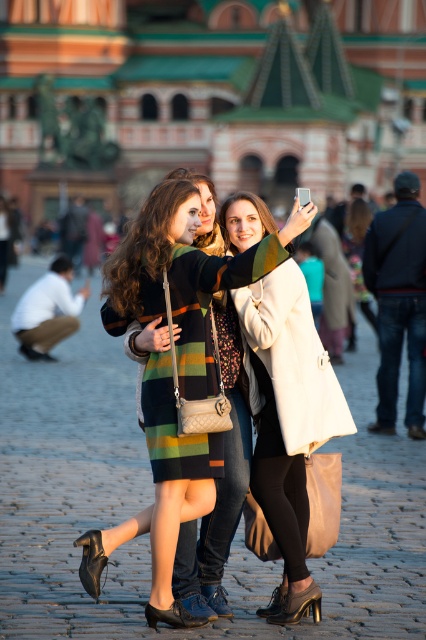
Question: Can you confirm if striped wool dress at center is thinner than white leather coat at center?

Choices:
 (A) yes
 (B) no

Answer: (B)

Question: Which point is closer to the camera?

Choices:
 (A) white leather coat at center
 (B) striped wool dress at center

Answer: (B)

Question: Which object is positioned closest to the striped wool dress at center?

Choices:
 (A) white leather coat at center
 (B) dark blue jeans at right

Answer: (A)

Question: Which object is farther from the camera taking this photo?

Choices:
 (A) dark blue jeans at right
 (B) striped wool dress at center

Answer: (A)

Question: Does striped wool dress at center have a lesser width compared to white leather coat at center?

Choices:
 (A) yes
 (B) no

Answer: (B)

Question: Can you confirm if striped wool dress at center is thinner than white leather coat at center?

Choices:
 (A) no
 (B) yes

Answer: (A)